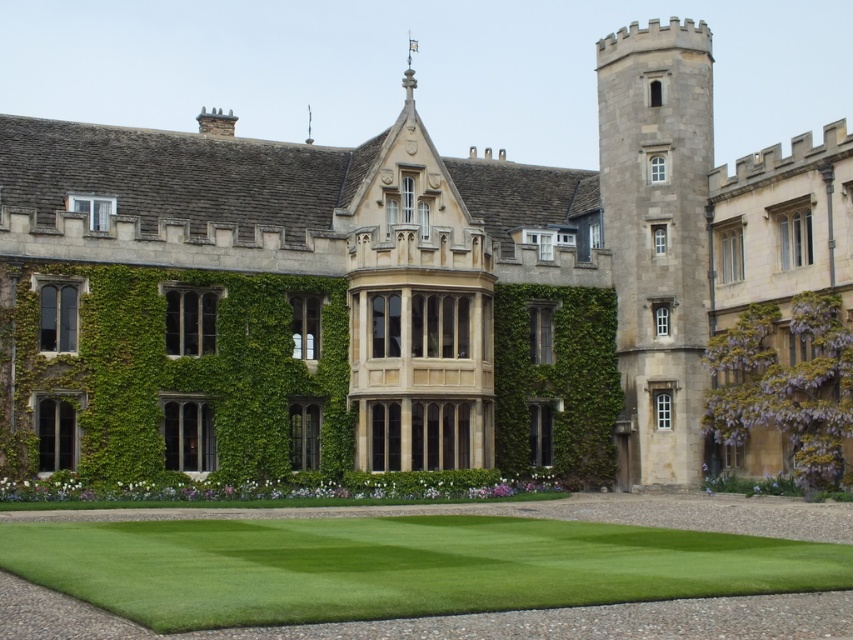
You are standing in front of the historic building and want to walk towards the purple leafy hedge at right. Which direction should you move relative to the green lawn at lower center?

To reach the purple leafy hedge at right from the green lawn at lower center, you should move to the right side of the green lawn at lower center since the purple leafy hedge at right is positioned to the right of the green lawn at lower center.